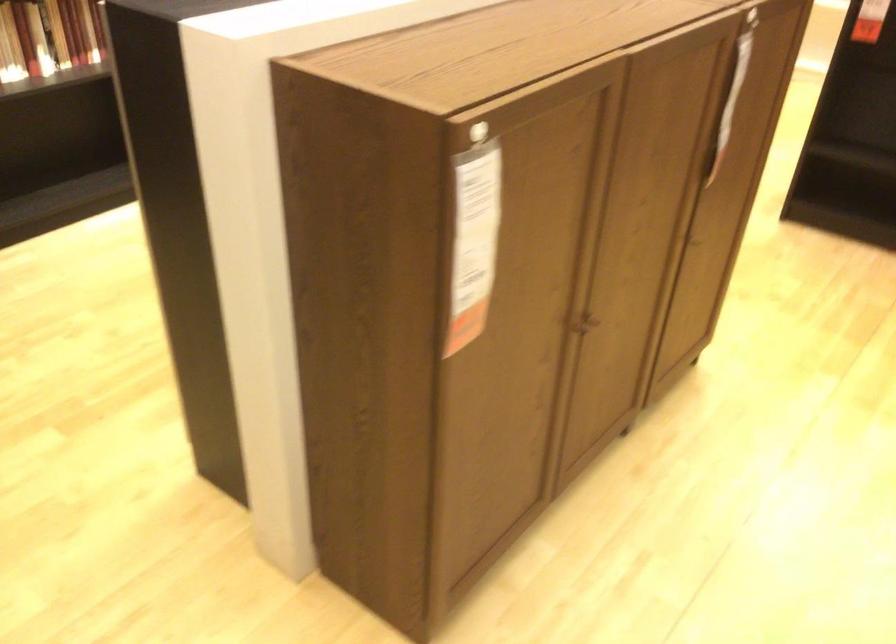
This screenshot has width=896, height=644. What do you see at coordinates (583, 323) in the screenshot?
I see `the fabric door pull` at bounding box center [583, 323].